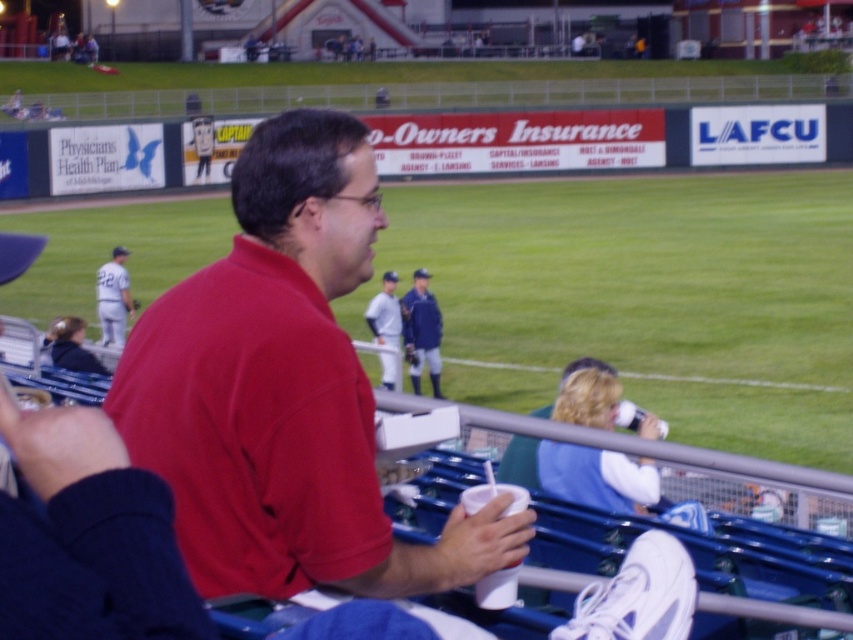
You are a spectator at the baseball stadium and want to throw a small ball to the person in the white uniform at left. If you can throw the ball 20 meters, will you be able to reach them?

The distance between you and the white uniform at left is 19.96 meters. Since your throw can reach 20 meters, you can successfully throw the ball to them.

You are a photographer standing at the center of the baseball stadium. You want to take a photo of two specific points in the image, point 1 at coordinates point (97, 291) and point 2 at coordinates point (399, 330). Which point is closer to your camera?

Point (97, 291) is closer to the camera than point (399, 330) because it is further to the camera than the other point.

You are a photographer at the baseball stadium. You need to capture a photo of the blue fabric jacket at center and the white uniform at left. Which object should you zoom in more on to ensure both are clearly visible in the frame?

You should zoom in more on the white uniform at left because it is smaller than the blue fabric jacket at center, so zooming in on the smaller one will help both fit clearly in the frame.